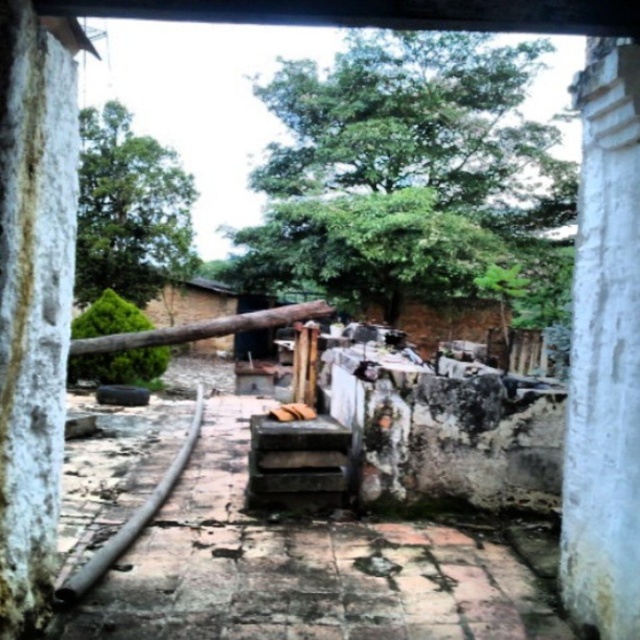
You are standing in a garden and see the concrete block at center and the white rough stone pillar at left. Which object is located to the right of the other?

The concrete block at center is positioned on the right side of white rough stone pillar at left, so the concrete block at center is to the right of the white rough stone pillar at left.